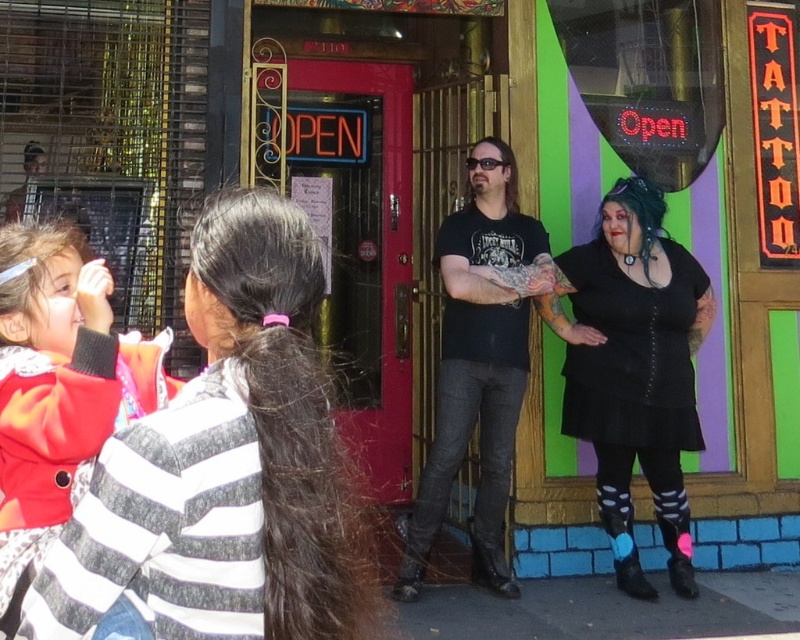
Between point (226, 321) and point (570, 416), which one is positioned in front?

Point (226, 321)

Is striped sweater at center to the right of black textured dress at center from the viewer's perspective?

No, striped sweater at center is not to the right of black textured dress at center.

Where is `striped sweater at center`? striped sweater at center is located at coordinates (226, 468).

Locate an element on the screen. striped sweater at center is located at coordinates (226, 468).

Based on the photo, between striped sweater at center and black matte t-shirt at center, which one is positioned lower?

Positioned lower is striped sweater at center.

Which is more to the left, striped sweater at center or black matte t-shirt at center?

striped sweater at center is more to the left.

Which is in front, point (285, 269) or point (442, 266)?

Positioned in front is point (285, 269).

This screenshot has width=800, height=640. In order to click on striped sweater at center in this screenshot , I will do `click(226, 468)`.

Based on the photo, is matte red jacket at left to the right of black matte t-shirt at center from the viewer's perspective?

Incorrect, matte red jacket at left is not on the right side of black matte t-shirt at center.

Between point (2, 596) and point (462, 401), which one is positioned in front?

Point (2, 596)

What are the coordinates of `matte red jacket at left` in the screenshot? It's located at (58, 388).